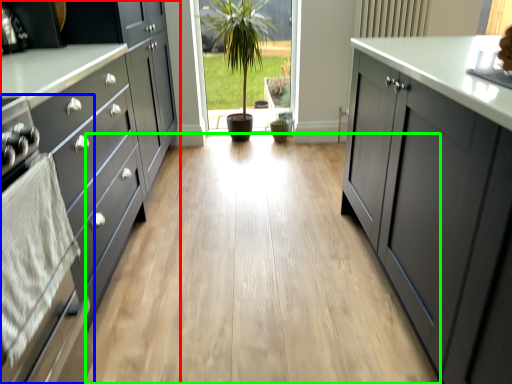
Question: Which is farther away from cabinetry (highlighted by a red box)? oven (highlighted by a blue box) or plain (highlighted by a green box)?

Choices:
 (A) oven
 (B) plain

Answer: (B)